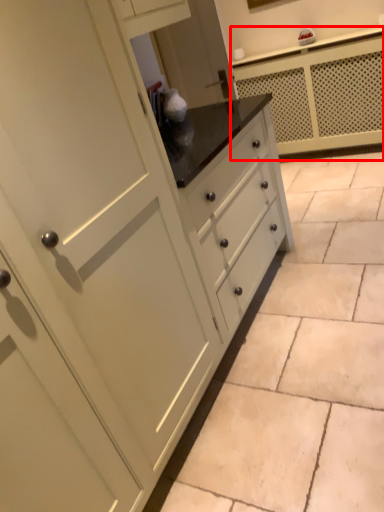
Question: Where is counter (annotated by the red box) located in relation to ceramic tile in the image?

Choices:
 (A) left
 (B) right

Answer: (B)